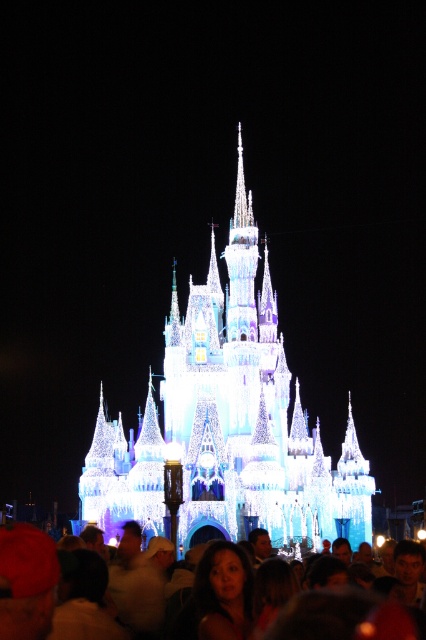
Question: Among these objects, which one is farthest from the camera?

Choices:
 (A) matte white crowd at lower center
 (B) illuminated glass castle at center

Answer: (B)

Question: Can you confirm if illuminated glass castle at center is thinner than matte white crowd at lower center?

Choices:
 (A) no
 (B) yes

Answer: (A)

Question: Among these objects, which one is farthest from the camera?

Choices:
 (A) matte white crowd at lower center
 (B) illuminated glass castle at center

Answer: (B)

Question: Can you confirm if illuminated glass castle at center is positioned to the left of matte white crowd at lower center?

Choices:
 (A) no
 (B) yes

Answer: (A)

Question: Can you confirm if illuminated glass castle at center is positioned below matte white crowd at lower center?

Choices:
 (A) no
 (B) yes

Answer: (A)